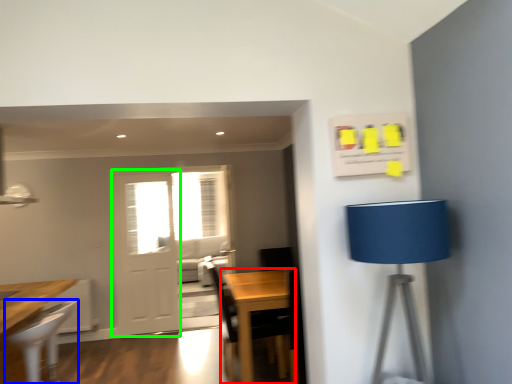
Question: Which is nearer to the table (highlighted by a red box)? chair (highlighted by a blue box) or screen door (highlighted by a green box).

Choices:
 (A) chair
 (B) screen door

Answer: (A)